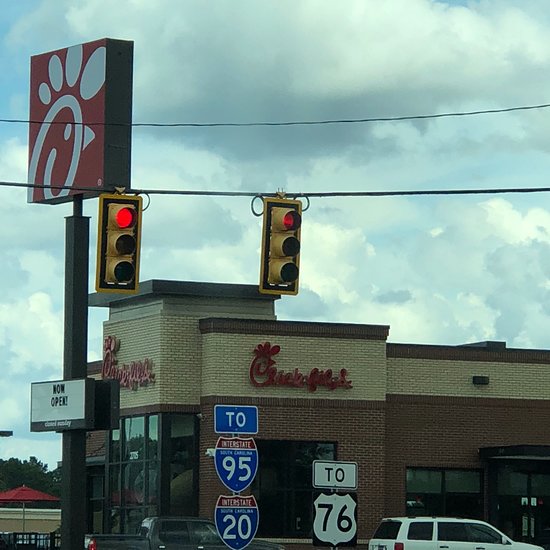
Locate an element on the screen. The width and height of the screenshot is (550, 550). windows is located at coordinates (472, 500), (424, 491), (528, 497), (293, 472), (239, 474), (278, 515), (299, 517), (147, 486).